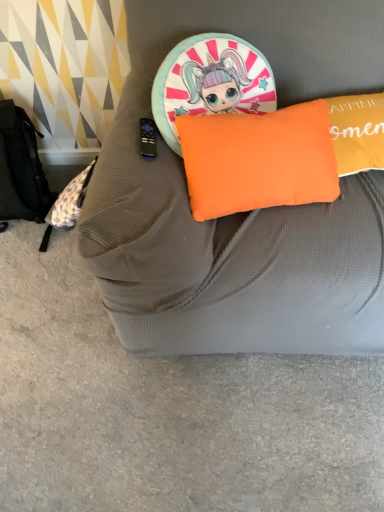
Find the location of `orange fabric cushion at upper center`. orange fabric cushion at upper center is located at coordinates (243, 213).

Based on the photo, what is the approximate width of orange fabric cushion at upper center?

orange fabric cushion at upper center is 37.45 inches wide.

This screenshot has width=384, height=512. What do you see at coordinates (243, 213) in the screenshot? I see `orange fabric cushion at upper center` at bounding box center [243, 213].

Locate an element on the screen. Image resolution: width=384 pixels, height=512 pixels. orange fabric pillow at center is located at coordinates (258, 160).

The width and height of the screenshot is (384, 512). Describe the element at coordinates (258, 160) in the screenshot. I see `orange fabric pillow at center` at that location.

Find the location of `orange fabric cushion at upper center`. orange fabric cushion at upper center is located at coordinates (243, 213).

Considering the positions of objects orange fabric pillow at center and orange fabric cushion at upper center in the image provided, who is more to the left, orange fabric pillow at center or orange fabric cushion at upper center?

From the viewer's perspective, orange fabric pillow at center appears more on the left side.

Which object is closer to the camera taking this photo, orange fabric pillow at center or orange fabric cushion at upper center?

orange fabric cushion at upper center is more forward.

Which is in front, point (313, 131) or point (311, 60)?

The point (313, 131) is more forward.

From the image's perspective, is orange fabric pillow at center located above or below orange fabric cushion at upper center?

orange fabric pillow at center is situated lower than orange fabric cushion at upper center in the image.

In the scene shown: From a real-world perspective, which is physically above, orange fabric pillow at center or orange fabric cushion at upper center?

orange fabric pillow at center is physically above.

Is orange fabric pillow at center thinner than orange fabric cushion at upper center?

Yes, orange fabric pillow at center is thinner than orange fabric cushion at upper center.

Does orange fabric pillow at center have a greater height compared to orange fabric cushion at upper center?

In fact, orange fabric pillow at center may be shorter than orange fabric cushion at upper center.

Can you confirm if orange fabric pillow at center is bigger than orange fabric cushion at upper center?

Actually, orange fabric pillow at center might be smaller than orange fabric cushion at upper center.

Does orange fabric pillow at center contain orange fabric cushion at upper center?

Actually, orange fabric cushion at upper center is outside orange fabric pillow at center.

Is orange fabric pillow at center far from orange fabric cushion at upper center?

That's not correct — orange fabric pillow at center is a little close to orange fabric cushion at upper center.

Is orange fabric pillow at center looking in the opposite direction of orange fabric cushion at upper center?

Yes, orange fabric cushion at upper center is at the back of orange fabric pillow at center.

At what (x,y) coordinates should I click in order to perform the action: click on furniture in front of the orange fabric pillow at center. Please return your answer as a coordinate pair (x, y). This screenshot has height=512, width=384. Looking at the image, I should click on (243, 213).

Based on the photo, is orange fabric cushion at upper center to the right of orange fabric pillow at center from the viewer's perspective?

Correct, you'll find orange fabric cushion at upper center to the right of orange fabric pillow at center.

Looking at this image, is orange fabric cushion at upper center in front of orange fabric pillow at center?

Yes, orange fabric cushion at upper center is closer to the camera.

Which is in front, point (202, 269) or point (272, 146)?

Point (202, 269)

From the image's perspective, is orange fabric cushion at upper center on orange fabric pillow at center?

Yes, from the image's perspective, orange fabric cushion at upper center is over orange fabric pillow at center.

From a real-world perspective, does orange fabric cushion at upper center sit lower than orange fabric pillow at center?

Yes.

Between orange fabric cushion at upper center and orange fabric pillow at center, which one has smaller width?

Thinner between the two is orange fabric pillow at center.

Considering the sizes of objects orange fabric cushion at upper center and orange fabric pillow at center in the image provided, who is shorter, orange fabric cushion at upper center or orange fabric pillow at center?

orange fabric pillow at center.

Is orange fabric cushion at upper center smaller than orange fabric pillow at center?

No.

Is orange fabric pillow at center surrounded by orange fabric cushion at upper center?

Yes, orange fabric pillow at center is a part of orange fabric cushion at upper center.

Are orange fabric cushion at upper center and orange fabric pillow at center beside each other?

No, orange fabric cushion at upper center is not touching orange fabric pillow at center.

Does orange fabric cushion at upper center turn towards orange fabric pillow at center?

Yes.

How different are the orientations of orange fabric cushion at upper center and orange fabric pillow at center in degrees?

The angle between the facing direction of orange fabric cushion at upper center and the facing direction of orange fabric pillow at center is 8.92 degrees.

Identify the location of furniture above the orange fabric pillow at center (from the image's perspective). click(243, 213).

In order to click on furniture on the right of the orange fabric pillow at center in this screenshot , I will do `click(243, 213)`.

I want to click on furniture that is in front of the orange fabric pillow at center, so click(x=243, y=213).